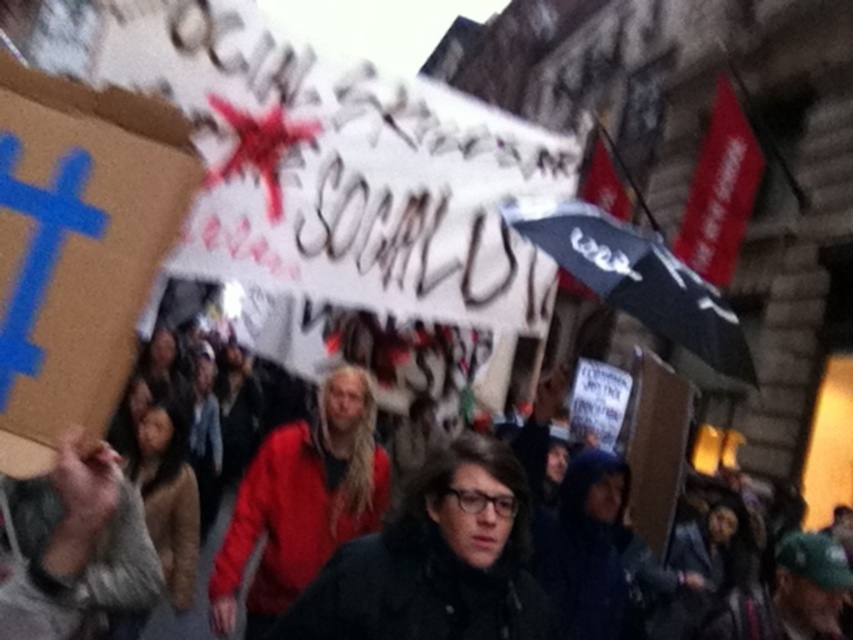
You are a photographer trying to capture the protest scene. You are standing at the edge of the crowd and want to take a photo of the black matte umbrella at upper right and the black fabric crowd at center. If your camera has a maximum focus range of 3.5 meters, will you be able to capture both objects in focus simultaneously?

The black matte umbrella at upper right is 4.07 meters from the black fabric crowd at center. Since the distance between them exceeds the camera maximum focus range of 3.5 meters, you cannot capture both objects in focus at the same time.

You are a photographer standing at the edge of the protest scene. You want to take a photo that includes both the Socialist sign and the hashtag sign. The Socialist sign is located at point (596, 291) and the hashtag sign at point (27, 612). Which sign should you focus on first to ensure both are in focus?

You should focus on the Socialist sign at point (596, 291) first because it is closer to the camera than the hashtag sign at point (27, 612). This way, both signs will be in focus as the hashtag sign is further away.